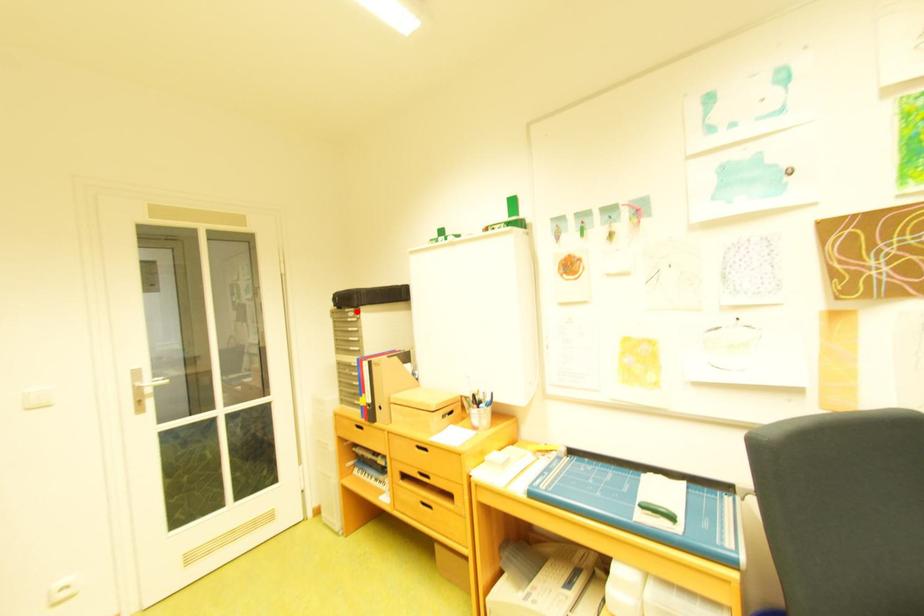
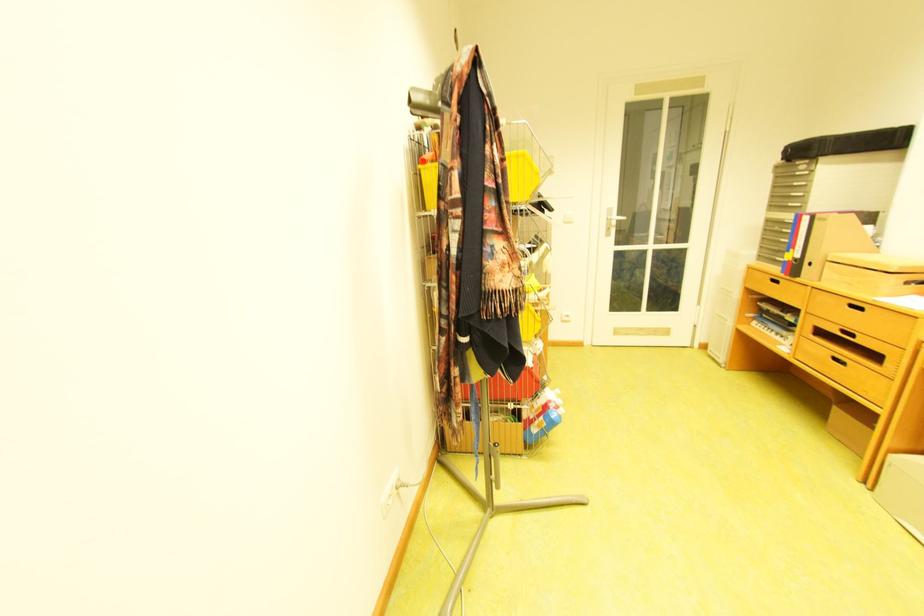
Locate, in the second image, the point that corresponds to the highlighted location in the first image.

(808, 164)